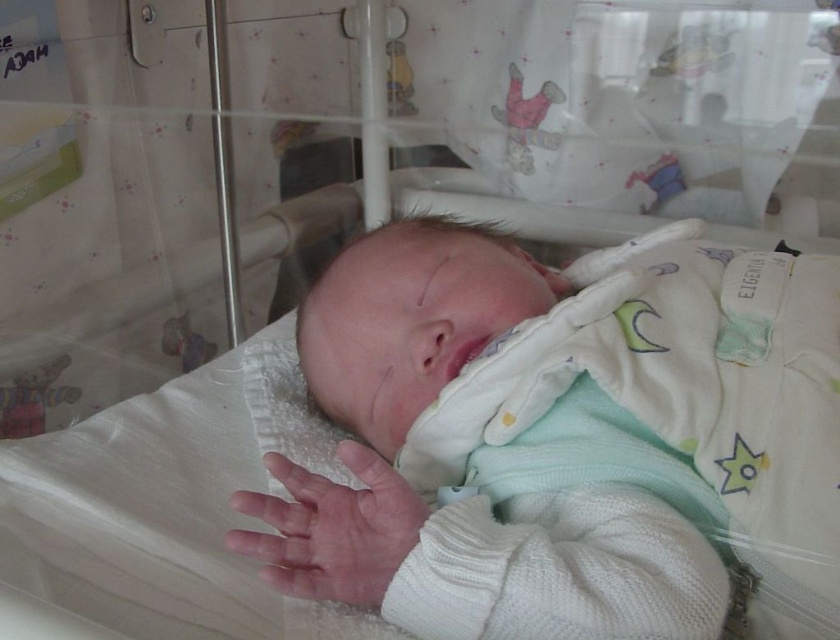
Question: Where is white knitted sweater at center located in relation to pink soft skin at center in the image?

Choices:
 (A) left
 (B) right

Answer: (B)

Question: Which of the following is the closest to the observer?

Choices:
 (A) (348, 392)
 (B) (244, 548)

Answer: (B)

Question: From the image, what is the correct spatial relationship of white knitted sweater at center in relation to pink soft skin at center?

Choices:
 (A) above
 (B) below

Answer: (A)

Question: Does white knitted sweater at center have a smaller size compared to pink soft skin at center?

Choices:
 (A) no
 (B) yes

Answer: (A)